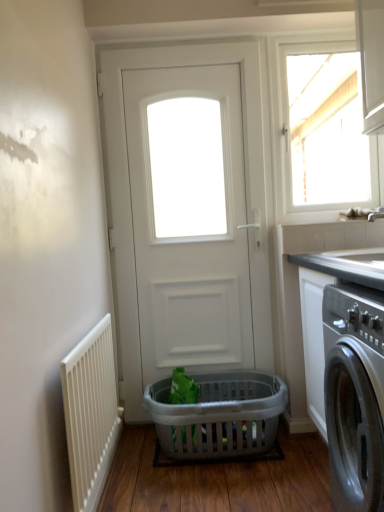
Question: Is translucent plastic basket at lower center in front of or behind white matte door at center in the image?

Choices:
 (A) behind
 (B) front

Answer: (B)

Question: From their relative heights in the image, would you say translucent plastic basket at lower center is taller or shorter than white matte door at center?

Choices:
 (A) short
 (B) tall

Answer: (A)

Question: Which object is the closest to the white plastic radiator at lower left?

Choices:
 (A) white matte door at center
 (B) white glossy window at upper right
 (C) smooth gray countertop at right
 (D) translucent plastic basket at lower center

Answer: (D)

Question: Which of these objects is positioned farthest from the white glossy window at upper right?

Choices:
 (A) translucent plastic basket at lower center
 (B) white plastic radiator at lower left
 (C) white matte door at center
 (D) smooth gray countertop at right

Answer: (B)